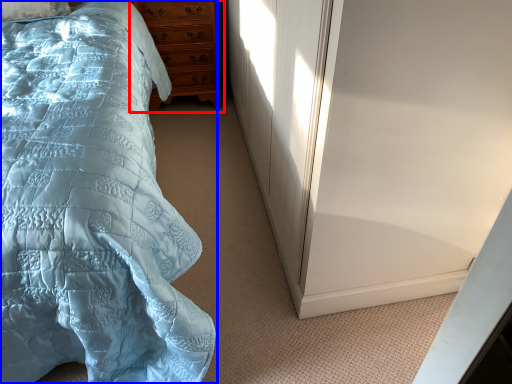
Question: Which object is further to the camera taking this photo, chest of drawers (highlighted by a red box) or bed (highlighted by a blue box)?

Choices:
 (A) chest of drawers
 (B) bed

Answer: (A)